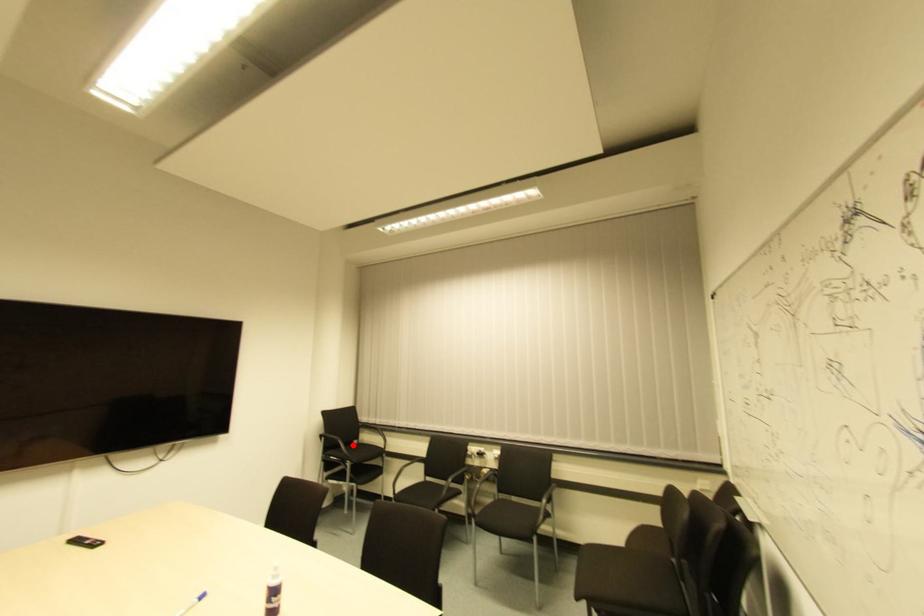
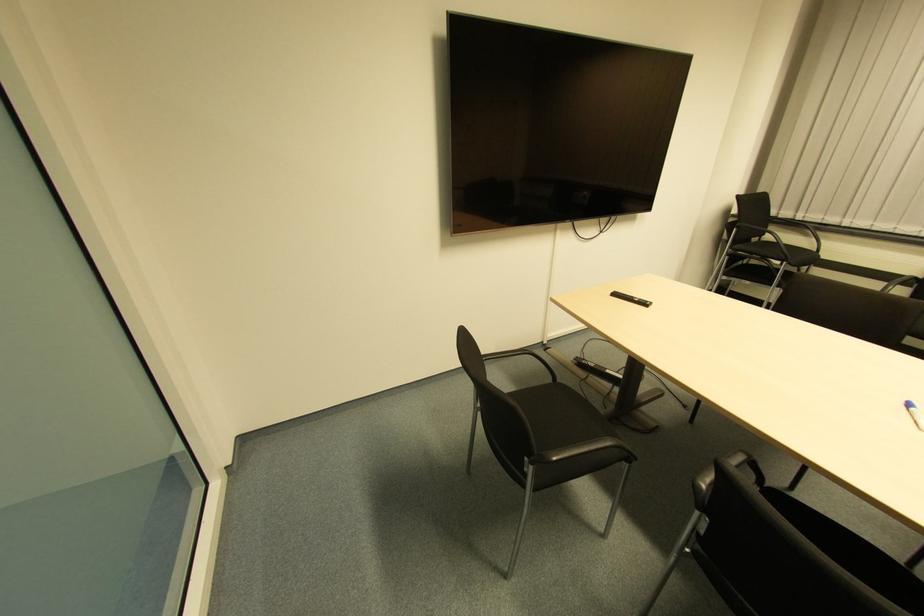
Where in the second image is the point corresponding to the highlighted location from the first image?

(752, 243)